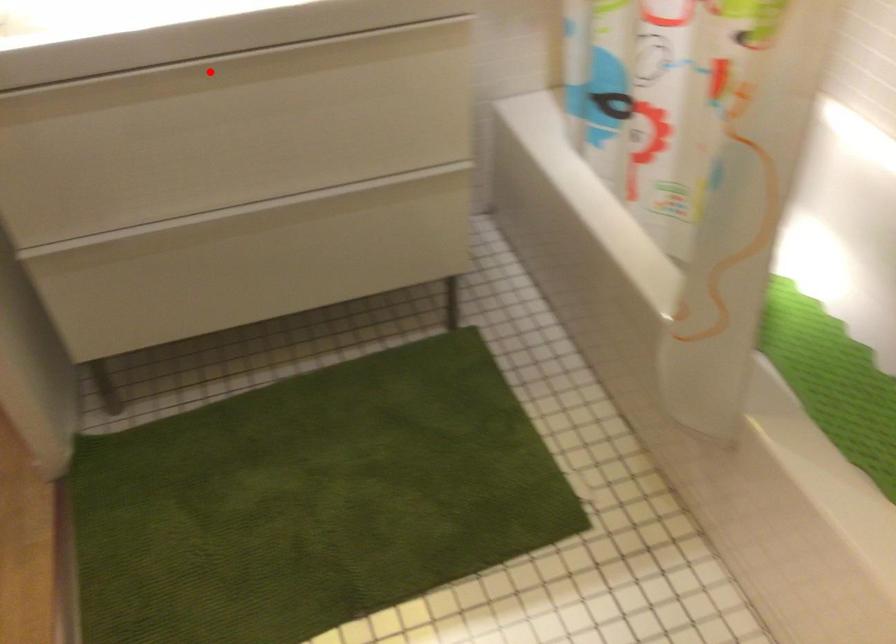
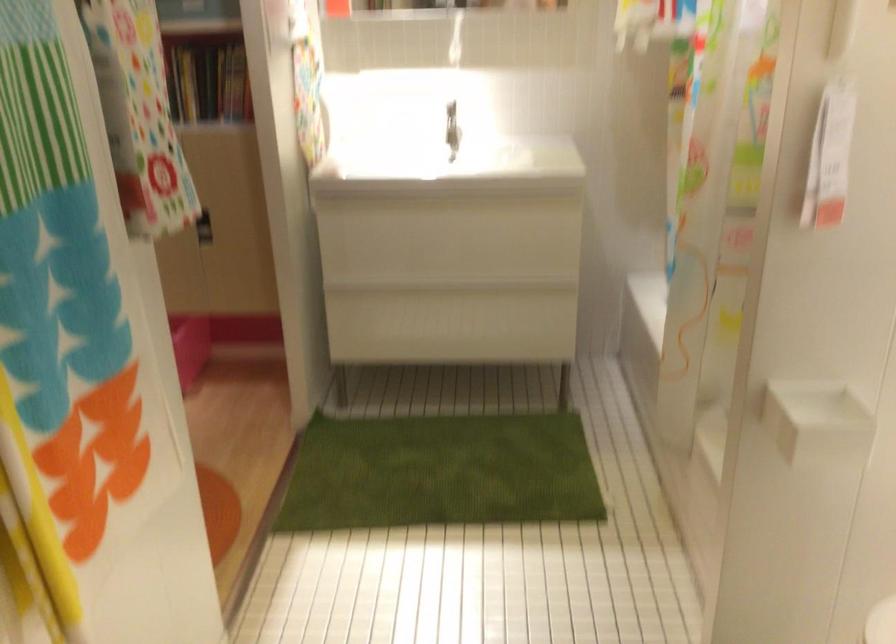
Question: I am providing you with two images of the same scene from different viewpoints. Image1 has a red point marked. In image2, the corresponding 3D location appears at what relative position? Reply with the corresponding letter.

Choices:
 (A) Closer
 (B) Farther

Answer: (B)